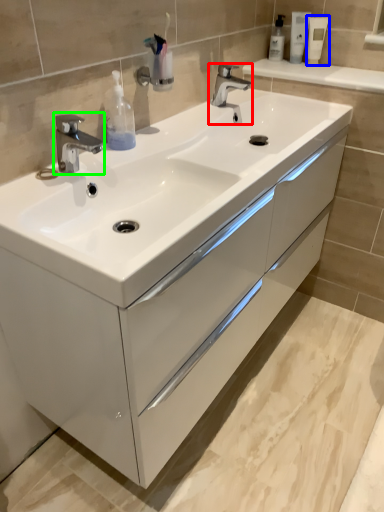
Question: Based on their relative distances, which object is nearer to tap (highlighted by a red box)? Choose from mouthwash (highlighted by a blue box) and tap (highlighted by a green box).

Choices:
 (A) mouthwash
 (B) tap

Answer: (A)